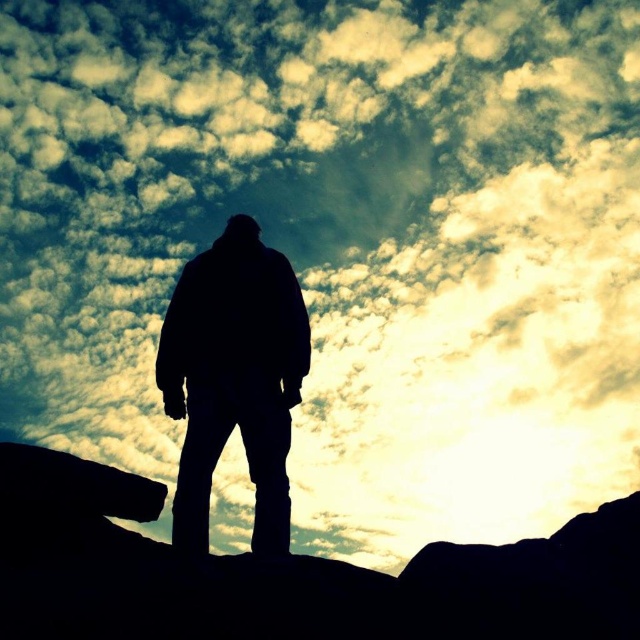
Can you confirm if black rock at center is thinner than silhouette jacket at center?

Incorrect, black rock at center's width is not less than silhouette jacket at center's.

Measure the distance between point (513, 636) and camera.

They are 8.32 meters apart.

Where is `black rock at center`? This screenshot has height=640, width=640. black rock at center is located at coordinates (285, 573).